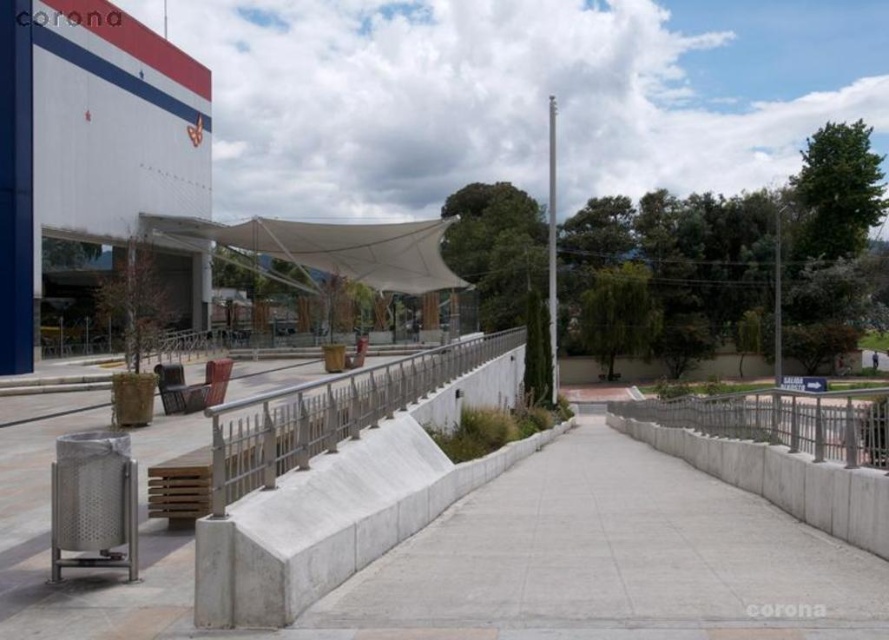
Does silver metallic rail at center lie behind white fabric canopy at center?

No, silver metallic rail at center is closer to the viewer.

Who is positioned more to the left, silver metallic rail at center or white fabric canopy at center?

From the viewer's perspective, white fabric canopy at center appears more on the left side.

Does point (230, 408) come in front of point (351, 280)?

Yes, it is in front of point (351, 280).

You are a GUI agent. You are given a task and a screenshot of the screen. Output one action in this format:
    pyautogui.click(x=<x>, y=<y>)
    Task: Click on the silver metallic rail at center
    The height and width of the screenshot is (640, 889).
    Given the screenshot: What is the action you would take?
    pyautogui.click(x=327, y=413)

Can you confirm if concrete at center is shorter than white fabric canopy at center?

Yes, concrete at center is shorter than white fabric canopy at center.

Who is shorter, concrete at center or white fabric canopy at center?

With less height is concrete at center.

Is point (449, 592) positioned before point (329, 227)?

Yes.

Find the location of a particular element. This screenshot has height=640, width=889. concrete at center is located at coordinates [610, 557].

Is concrete at center above silver metallic rail at center?

Incorrect, concrete at center is not positioned above silver metallic rail at center.

Can you confirm if concrete at center is smaller than silver metallic rail at center?

Correct, concrete at center occupies less space than silver metallic rail at center.

Is point (709, 572) positioned in front of point (252, 401)?

Yes, point (709, 572) is closer to viewer.

This screenshot has height=640, width=889. Find the location of `concrete at center`. concrete at center is located at coordinates (610, 557).